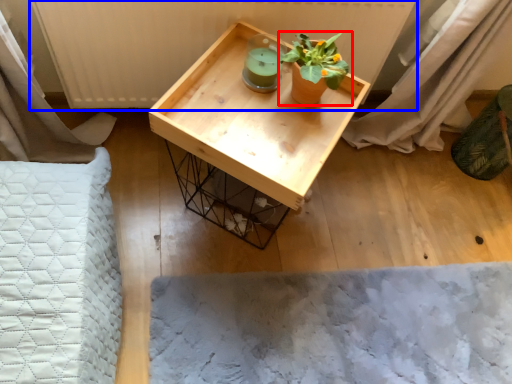
Question: Which point is closer to the camera, houseplant (highlighted by a red box) or radiator (highlighted by a blue box)?

Choices:
 (A) houseplant
 (B) radiator

Answer: (A)